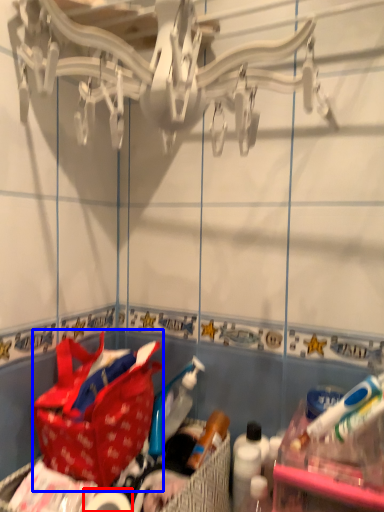
Question: Among these objects, which one is farthest to the camera, toilet paper (highlighted by a red box) or handbag (highlighted by a blue box)?

Choices:
 (A) toilet paper
 (B) handbag

Answer: (B)